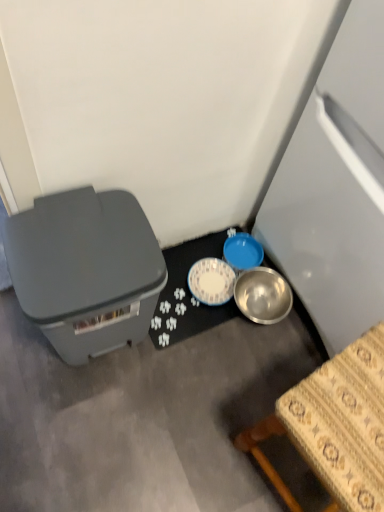
Question: Can you confirm if wooden table at lower right is wider than metallic silver bowl at lower center?

Choices:
 (A) yes
 (B) no

Answer: (A)

Question: Is wooden table at lower right thinner than metallic silver bowl at lower center?

Choices:
 (A) no
 (B) yes

Answer: (A)

Question: Is wooden table at lower right to the right of metallic silver bowl at lower center from the viewer's perspective?

Choices:
 (A) yes
 (B) no

Answer: (A)

Question: Is wooden table at lower right looking in the opposite direction of metallic silver bowl at lower center?

Choices:
 (A) yes
 (B) no

Answer: (B)

Question: From a real-world perspective, is wooden table at lower right over metallic silver bowl at lower center?

Choices:
 (A) no
 (B) yes

Answer: (B)

Question: Is wooden table at lower right far away from metallic silver bowl at lower center?

Choices:
 (A) no
 (B) yes

Answer: (A)

Question: Is metallic silver bowl at lower center directly adjacent to blue plastic bowl at center-right?

Choices:
 (A) no
 (B) yes

Answer: (A)

Question: Considering the relative sizes of metallic silver bowl at lower center and blue plastic bowl at center-right in the image provided, is metallic silver bowl at lower center smaller than blue plastic bowl at center-right?

Choices:
 (A) no
 (B) yes

Answer: (A)

Question: Is metallic silver bowl at lower center aimed at blue plastic bowl at center-right?

Choices:
 (A) no
 (B) yes

Answer: (A)

Question: From a real-world perspective, is metallic silver bowl at lower center under blue plastic bowl at center-right?

Choices:
 (A) no
 (B) yes

Answer: (B)

Question: Is the depth of metallic silver bowl at lower center greater than that of blue plastic bowl at center-right?

Choices:
 (A) no
 (B) yes

Answer: (A)

Question: Is metallic silver bowl at lower center facing away from blue plastic bowl at center-right?

Choices:
 (A) yes
 (B) no

Answer: (B)

Question: Does matte gray storage box at left have a lesser height compared to wooden table at lower right?

Choices:
 (A) no
 (B) yes

Answer: (B)